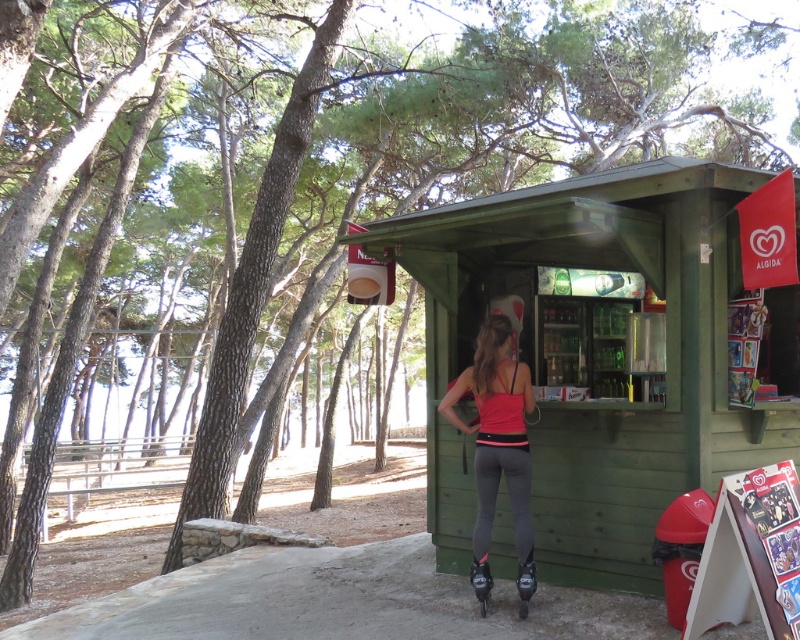
You are a customer at the green wooden hut at center and want to know if you can fit a large cooler next to your matte pink tank top at center. The cooler is as wide as the hut. Can it fit?

The green wooden hut at center is wider than the matte pink tank top at center, so the cooler, being as wide as the hut, may not fit next to the matte pink tank top at center due to space constraints.

You are a customer at the kiosk and want to place your roller skates on the ground next to you while ordering. Which of the two pairs of roller skates, the black matte roller skates at lower center or the black rubber roller skates at lower center, is closer to the kiosk counter?

Both pairs of roller skates are at the same distance from the kiosk counter since they are both located at lower center. The distance between them is 10.30 inches, but their positions relative to the counter are the same.